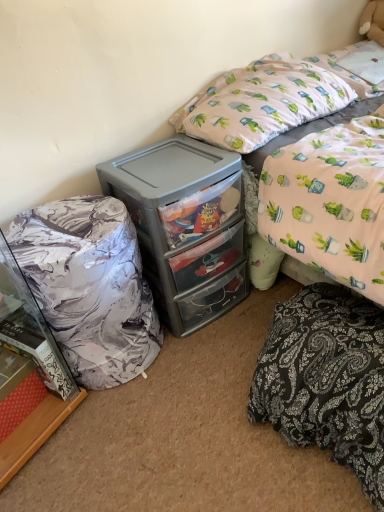
Question: From the image's perspective, is black paisley fabric at lower right above or below pink fabric bed at upper right?

Choices:
 (A) below
 (B) above

Answer: (A)

Question: Does point (375, 426) appear closer or farther from the camera than point (296, 105)?

Choices:
 (A) farther
 (B) closer

Answer: (B)

Question: Which of these objects is positioned farthest from the black paisley fabric at lower right?

Choices:
 (A) marble-patterned bean bag at left
 (B) pink fabric pillow at upper right
 (C) pink fabric bed at upper right
 (D) white plush teddy bear at upper right
 (E) gray plastic chest of drawers at center

Answer: (D)

Question: Estimate the real-world distances between objects in this image. Which object is farther from the marble-patterned bean bag at left?

Choices:
 (A) black paisley fabric at lower right
 (B) pink fabric pillow at upper right
 (C) marble-patterned cabinet at left
 (D) pink fabric bed at upper right
 (E) gray plastic chest of drawers at center

Answer: (B)